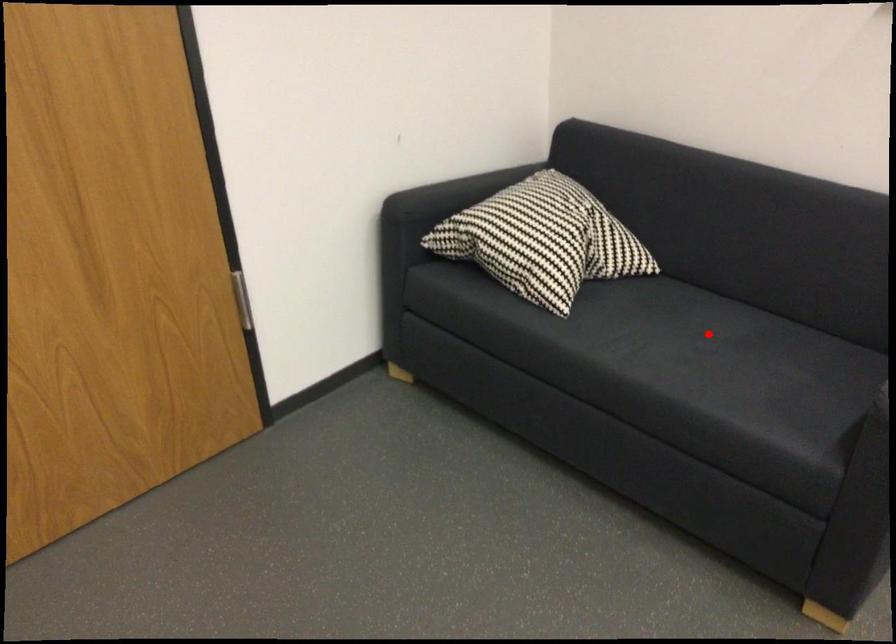
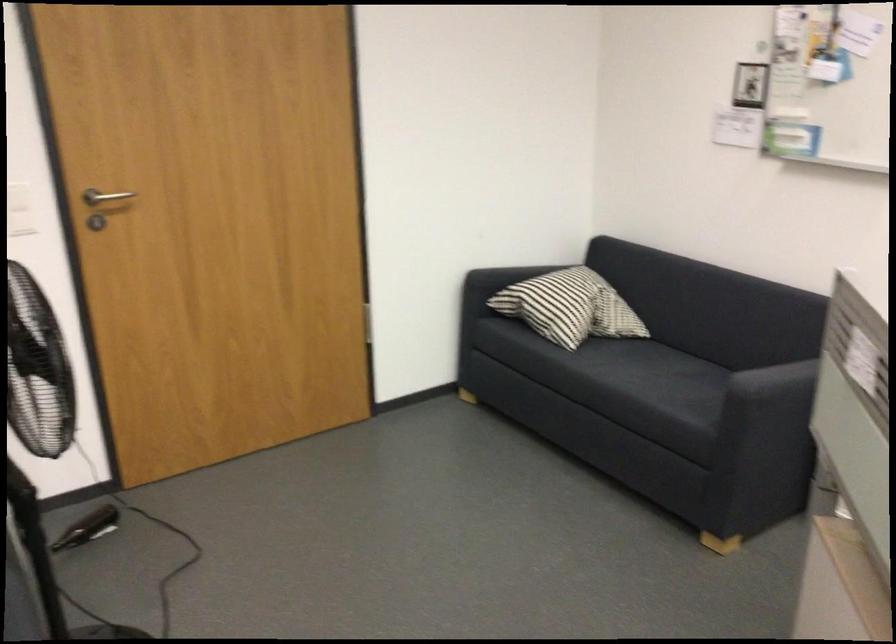
Where in the second image is the point corresponding to the highlighted location from the first image?

(668, 370)